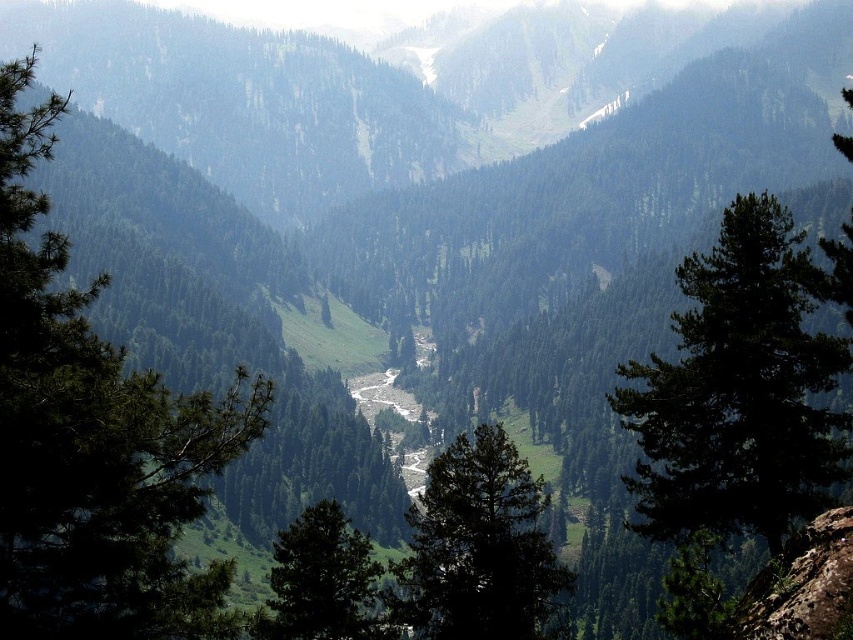
Question: Which of these objects is positioned farthest from the green leafy tree at center?

Choices:
 (A) green matte tree at right
 (B) green matte tree at center
 (C) green textured tree at center

Answer: (C)

Question: Can you confirm if green textured tree at center is smaller than green matte tree at right?

Choices:
 (A) no
 (B) yes

Answer: (A)

Question: Is green textured tree at center to the right of green leafy tree at center from the viewer's perspective?

Choices:
 (A) yes
 (B) no

Answer: (B)

Question: In this image, where is green textured tree at center located relative to green leafy tree at center?

Choices:
 (A) above
 (B) below

Answer: (A)

Question: Among these points, which one is farthest from the camera?

Choices:
 (A) (821, 474)
 (B) (183, 637)

Answer: (A)

Question: Which object is farther from the camera taking this photo?

Choices:
 (A) green textured tree at center
 (B) green leafy tree at center

Answer: (B)